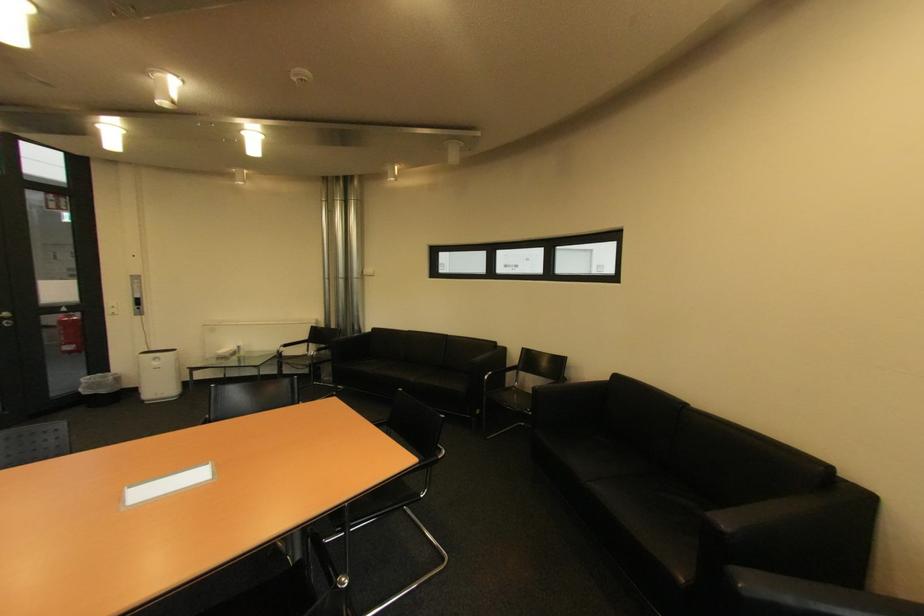
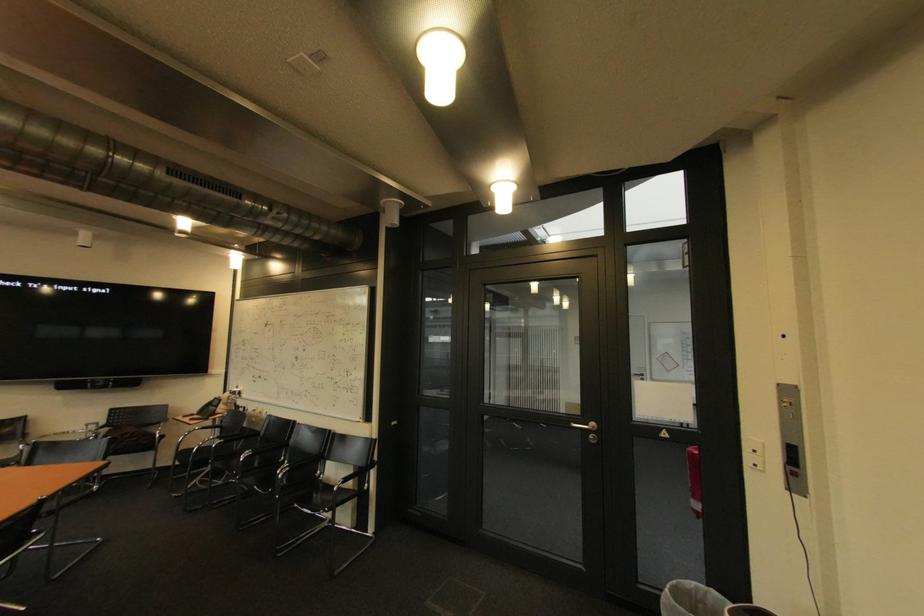
Where in the second image is the point corresponding to pixel 116 312 from the first image?

(757, 459)